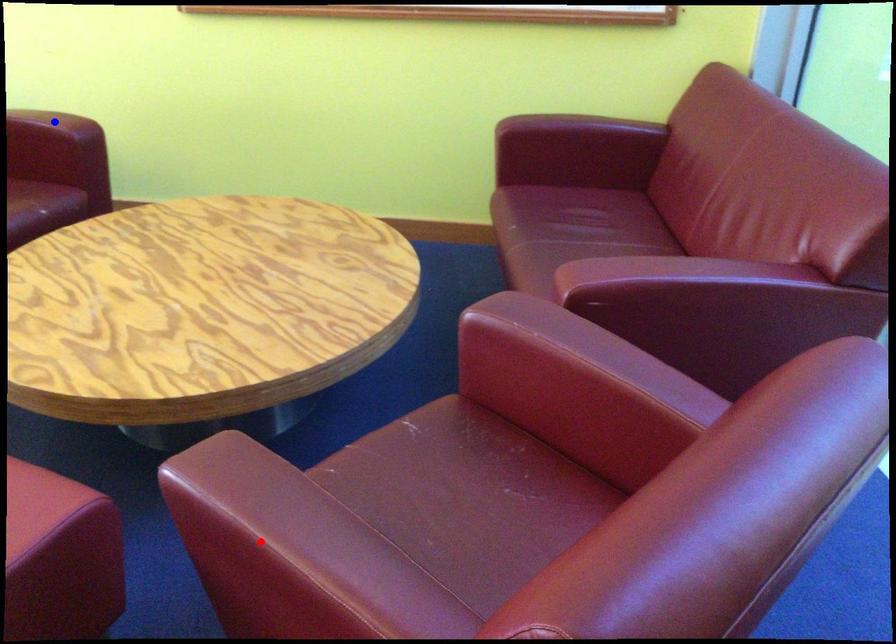
Question: Which of the two points in the image is closer to the camera?

Choices:
 (A) Blue point is closer.
 (B) Red point is closer.

Answer: (B)